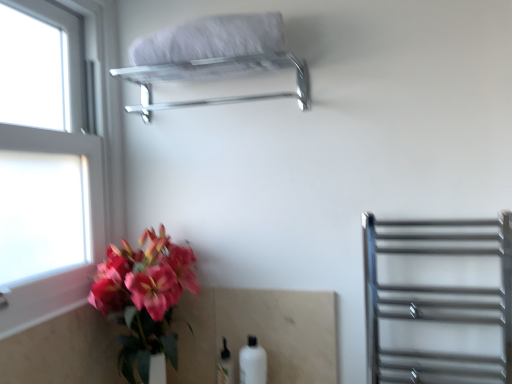
This screenshot has width=512, height=384. Identify the location of free region under white fluffy towel at upper center (from a real-world perspective). (214, 70).